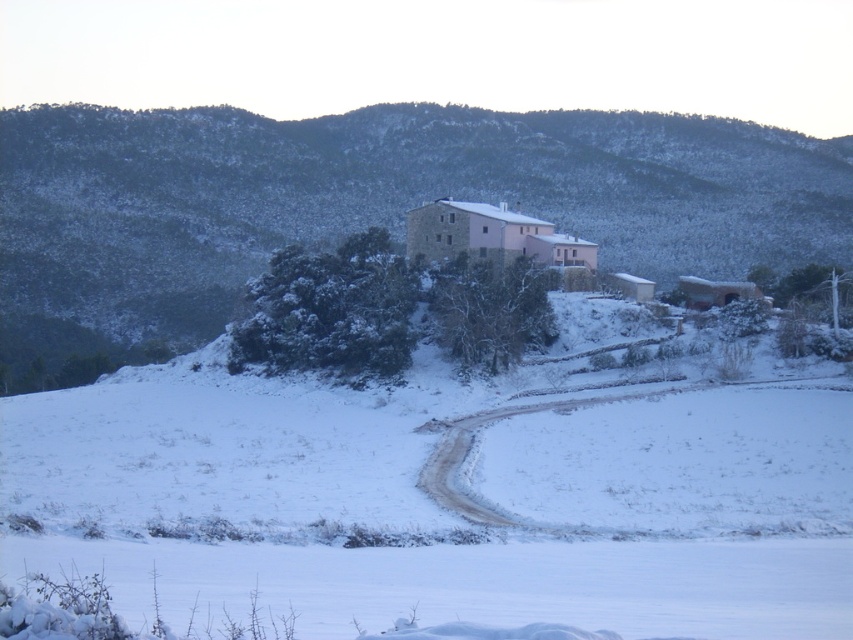
Does white powdery snow at center have a greater width compared to snow-covered stone mountain at upper center?

No.

Who is shorter, white powdery snow at center or snow-covered stone mountain at upper center?

Standing shorter between the two is white powdery snow at center.

Image resolution: width=853 pixels, height=640 pixels. I want to click on white powdery snow at center, so click(x=436, y=504).